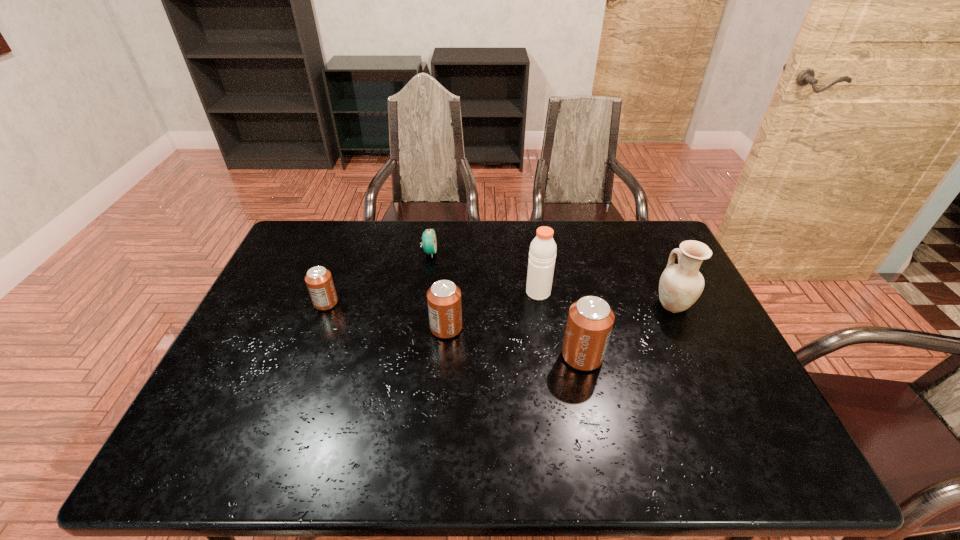
Locate an element on the screen. vacant area located on the front of the fifth tallest object is located at coordinates [289, 402].

I want to click on vacant space located 0.090m on the front of the second can from left to right, so click(444, 367).

Where is `free region located on the back of the tallest can`? free region located on the back of the tallest can is located at coordinates (563, 265).

Identify the location of vacant space located on the front-facing side of the fifth object from right to left. The width and height of the screenshot is (960, 540). (556, 252).

In order to click on free space located 0.090m on the left of the pottery in this screenshot , I will do `click(623, 305)`.

At what (x,y) coordinates should I click in order to perform the action: click on free space located on the front of the shaker. Please return your answer as a coordinate pair (x, y). Looking at the image, I should click on (547, 351).

Locate an element on the screen. This screenshot has width=960, height=540. object located in the far edge section of the desktop is located at coordinates (429, 241).

This screenshot has height=540, width=960. Find the location of `object that is positioned at the right edge`. object that is positioned at the right edge is located at coordinates (680, 285).

This screenshot has height=540, width=960. In the image, there is a desktop. In order to click on vacant space at the far edge in this screenshot , I will do `click(517, 219)`.

This screenshot has height=540, width=960. In order to click on free point at the near edge in this screenshot , I will do `click(325, 413)`.